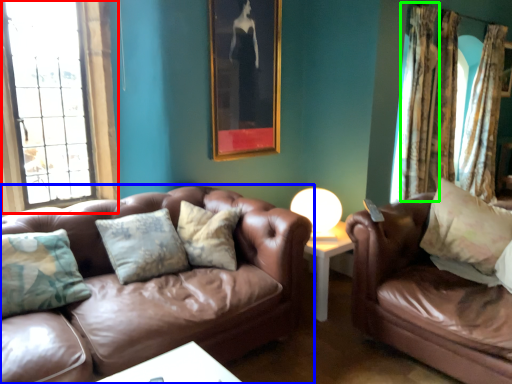
Question: Estimate the real-world distances between objects in this image. Which object is closer to window (highlighted by a red box), studio couch (highlighted by a blue box) or curtain (highlighted by a green box)?

Choices:
 (A) studio couch
 (B) curtain

Answer: (A)